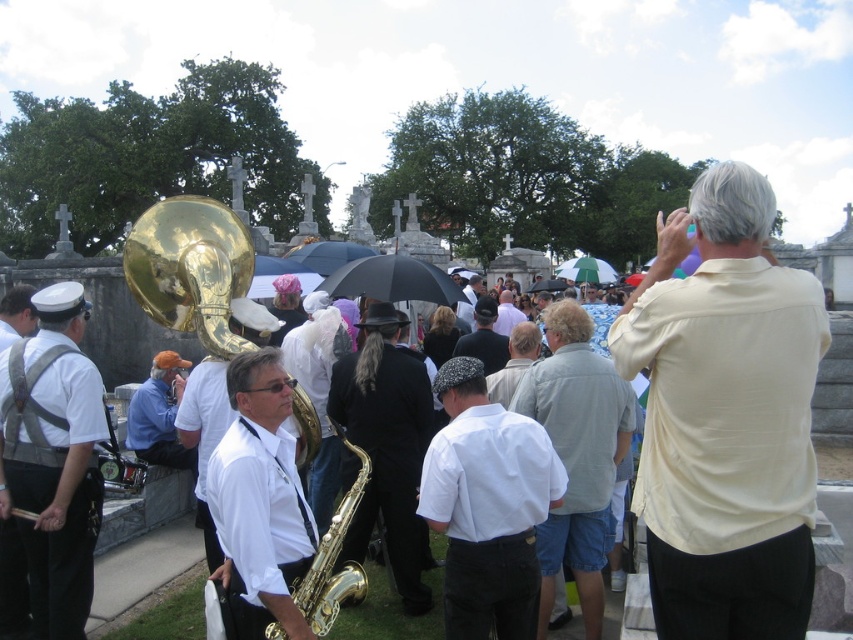
You are attending a memorial service at the cemetery and notice two items in the scene. One is the light yellow shirt at upper right and the other is the gold shiny saxophone at center. Which of these two items is positioned higher up in the image?

The light yellow shirt at upper right is positioned higher up in the image than the gold shiny saxophone at center.

What color is the shirt located at point (724, 417)?

The shirt at point (724, 417) is light yellow.